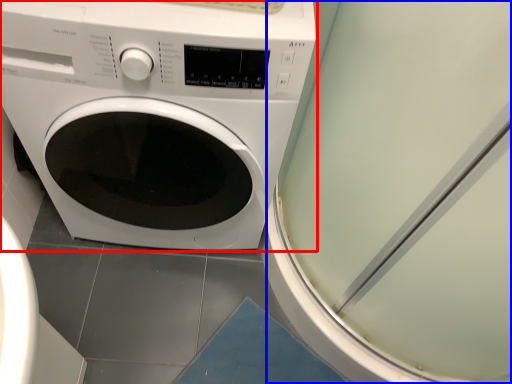
Question: Among these objects, which one is nearest to the camera, washing machine (highlighted by a red box) or screen door (highlighted by a blue box)?

Choices:
 (A) washing machine
 (B) screen door

Answer: (B)